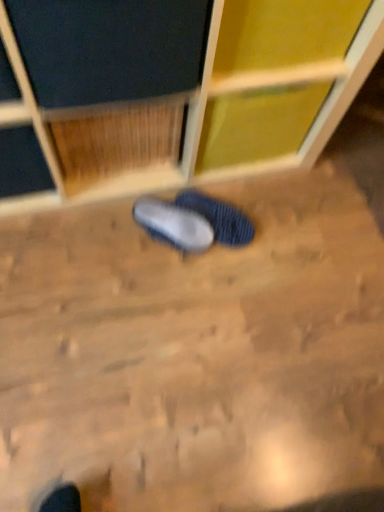
This screenshot has height=512, width=384. What do you see at coordinates (219, 217) in the screenshot?
I see `blue knitted slipper at center, which appears as the second footwear when viewed from the left` at bounding box center [219, 217].

I want to click on blue knitted slipper at center, which appears as the second footwear when viewed from the left, so click(x=219, y=217).

What is the approximate height of blue fabric slipper at center, the first footwear viewed from the left?

The height of blue fabric slipper at center, the first footwear viewed from the left, is 4.11 inches.

This screenshot has width=384, height=512. Describe the element at coordinates (174, 224) in the screenshot. I see `blue fabric slipper at center, which is the 2th footwear from right to left` at that location.

This screenshot has height=512, width=384. I want to click on blue fabric slipper at center, the first footwear viewed from the left, so click(174, 224).

In order to face blue fabric slipper at center, which is the 2th footwear from right to left, should I rotate leftwards or rightwards?

You should look left and rotate roughly 2.807 degrees.

At what (x,y) coordinates should I click in order to perform the action: click on blue knitted slipper at center, which is the 1th footwear from right to left. Please return your answer as a coordinate pair (x, y). The width and height of the screenshot is (384, 512). Looking at the image, I should click on (219, 217).

Which is more to the right, blue fabric slipper at center, which is the 2th footwear from right to left, or blue knitted slipper at center, which appears as the second footwear when viewed from the left?

blue knitted slipper at center, which appears as the second footwear when viewed from the left.

Who is more distant, blue fabric slipper at center, the first footwear viewed from the left, or blue knitted slipper at center, which appears as the second footwear when viewed from the left?

blue knitted slipper at center, which appears as the second footwear when viewed from the left, is further away from the camera.

Considering the positions of point (192, 233) and point (202, 199), is point (192, 233) closer or farther from the camera than point (202, 199)?

Clearly, point (192, 233) is closer to the camera than point (202, 199).

From the image's perspective, between blue fabric slipper at center, which is the 2th footwear from right to left, and blue knitted slipper at center, which is the 1th footwear from right to left, which one is located above?

blue knitted slipper at center, which is the 1th footwear from right to left.

From a real-world perspective, which is physically above, blue fabric slipper at center, which is the 2th footwear from right to left, or blue knitted slipper at center, which is the 1th footwear from right to left?

blue fabric slipper at center, which is the 2th footwear from right to left, is physically above.

Between blue fabric slipper at center, which is the 2th footwear from right to left, and blue knitted slipper at center, which appears as the second footwear when viewed from the left, which one has larger width?

blue knitted slipper at center, which appears as the second footwear when viewed from the left, is wider.

Is blue fabric slipper at center, which is the 2th footwear from right to left, taller or shorter than blue knitted slipper at center, which is the 1th footwear from right to left?

In the image, blue fabric slipper at center, which is the 2th footwear from right to left, appears to be shorter than blue knitted slipper at center, which is the 1th footwear from right to left.

Who is smaller, blue fabric slipper at center, the first footwear viewed from the left, or blue knitted slipper at center, which is the 1th footwear from right to left?

Smaller between the two is blue fabric slipper at center, the first footwear viewed from the left.

Which is correct: blue fabric slipper at center, which is the 2th footwear from right to left, is inside blue knitted slipper at center, which is the 1th footwear from right to left, or outside of it?

blue fabric slipper at center, which is the 2th footwear from right to left, cannot be found inside blue knitted slipper at center, which is the 1th footwear from right to left.

Is blue fabric slipper at center, which is the 2th footwear from right to left, beside blue knitted slipper at center, which is the 1th footwear from right to left?

Yes, blue fabric slipper at center, which is the 2th footwear from right to left, is right next to blue knitted slipper at center, which is the 1th footwear from right to left, and making contact.

Is blue fabric slipper at center, the first footwear viewed from the left, looking in the opposite direction of blue knitted slipper at center, which is the 1th footwear from right to left?

No, blue fabric slipper at center, the first footwear viewed from the left,'s orientation is not away from blue knitted slipper at center, which is the 1th footwear from right to left.

Looking at this image, can you tell me how much blue fabric slipper at center, which is the 2th footwear from right to left, and blue knitted slipper at center, which appears as the second footwear when viewed from the left, differ in facing direction?

blue fabric slipper at center, which is the 2th footwear from right to left, and blue knitted slipper at center, which appears as the second footwear when viewed from the left, are facing 0.000302 degrees away from each other.

Image resolution: width=384 pixels, height=512 pixels. What are the coordinates of `footwear below the blue knitted slipper at center, which is the 1th footwear from right to left (from the image's perspective)` in the screenshot? It's located at (174, 224).

From the picture: Considering the positions of objects blue knitted slipper at center, which appears as the second footwear when viewed from the left, and blue fabric slipper at center, the first footwear viewed from the left, in the image provided, who is more to the left, blue knitted slipper at center, which appears as the second footwear when viewed from the left, or blue fabric slipper at center, the first footwear viewed from the left,?

Positioned to the left is blue fabric slipper at center, the first footwear viewed from the left.

Is blue knitted slipper at center, which is the 1th footwear from right to left, closer to camera compared to blue fabric slipper at center, which is the 2th footwear from right to left?

That is False.

Which point is more forward, (205, 197) or (191, 218)?

Point (191, 218)

From the image's perspective, is blue knitted slipper at center, which appears as the second footwear when viewed from the left, located above blue fabric slipper at center, the first footwear viewed from the left?

Indeed, from the image's perspective, blue knitted slipper at center, which appears as the second footwear when viewed from the left, is shown above blue fabric slipper at center, the first footwear viewed from the left.

From a real-world perspective, is blue knitted slipper at center, which appears as the second footwear when viewed from the left, on blue fabric slipper at center, which is the 2th footwear from right to left?

No.

Based on the photo, looking at their sizes, would you say blue knitted slipper at center, which appears as the second footwear when viewed from the left, is wider or thinner than blue fabric slipper at center, the first footwear viewed from the left?

Clearly, blue knitted slipper at center, which appears as the second footwear when viewed from the left, has more width compared to blue fabric slipper at center, the first footwear viewed from the left.

Considering the sizes of objects blue knitted slipper at center, which appears as the second footwear when viewed from the left, and blue fabric slipper at center, which is the 2th footwear from right to left, in the image provided, who is taller, blue knitted slipper at center, which appears as the second footwear when viewed from the left, or blue fabric slipper at center, which is the 2th footwear from right to left,?

blue knitted slipper at center, which appears as the second footwear when viewed from the left.

Considering the relative sizes of blue knitted slipper at center, which appears as the second footwear when viewed from the left, and blue fabric slipper at center, which is the 2th footwear from right to left, in the image provided, is blue knitted slipper at center, which appears as the second footwear when viewed from the left, bigger than blue fabric slipper at center, which is the 2th footwear from right to left,?

Indeed, blue knitted slipper at center, which appears as the second footwear when viewed from the left, has a larger size compared to blue fabric slipper at center, which is the 2th footwear from right to left.

Which is correct: blue knitted slipper at center, which is the 1th footwear from right to left, is inside blue fabric slipper at center, the first footwear viewed from the left, or outside of it?

blue knitted slipper at center, which is the 1th footwear from right to left, cannot be found inside blue fabric slipper at center, the first footwear viewed from the left.

Would you consider blue knitted slipper at center, which is the 1th footwear from right to left, to be distant from blue fabric slipper at center, which is the 2th footwear from right to left?

No.

Is blue knitted slipper at center, which appears as the second footwear when viewed from the left, positioned with its back to blue fabric slipper at center, which is the 2th footwear from right to left?

That's not correct — blue knitted slipper at center, which appears as the second footwear when viewed from the left, is not looking away from blue fabric slipper at center, which is the 2th footwear from right to left.

What's the angular difference between blue knitted slipper at center, which appears as the second footwear when viewed from the left, and blue fabric slipper at center, the first footwear viewed from the left,'s facing directions?

0.000302 degrees separate the facing orientations of blue knitted slipper at center, which appears as the second footwear when viewed from the left, and blue fabric slipper at center, the first footwear viewed from the left.

This screenshot has width=384, height=512. In order to click on footwear that is in front of the blue knitted slipper at center, which is the 1th footwear from right to left in this screenshot , I will do `click(174, 224)`.

Locate an element on the screen. footwear below the blue fabric slipper at center, which is the 2th footwear from right to left (from a real-world perspective) is located at coordinates (219, 217).

Where is `footwear in front of the blue knitted slipper at center, which is the 1th footwear from right to left`? footwear in front of the blue knitted slipper at center, which is the 1th footwear from right to left is located at coordinates (174, 224).